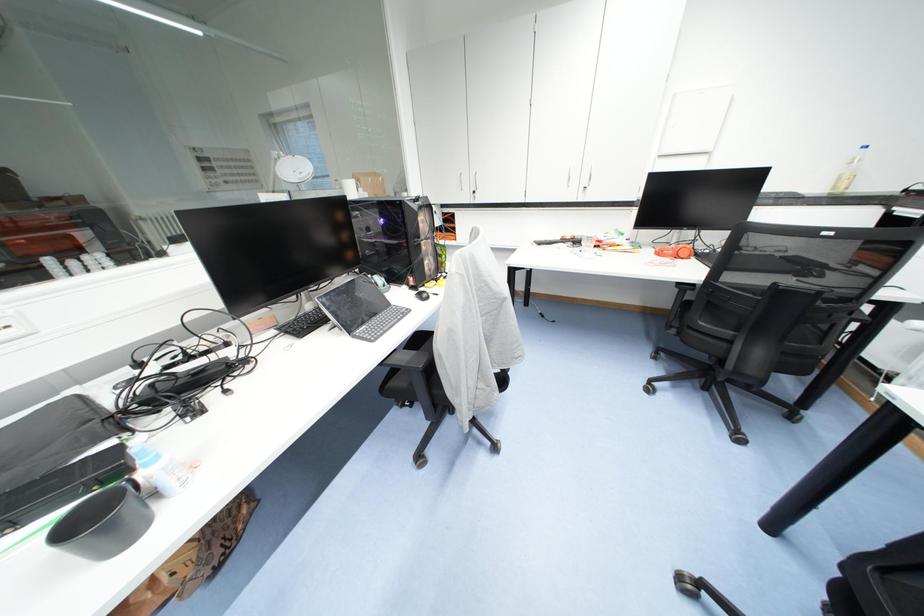
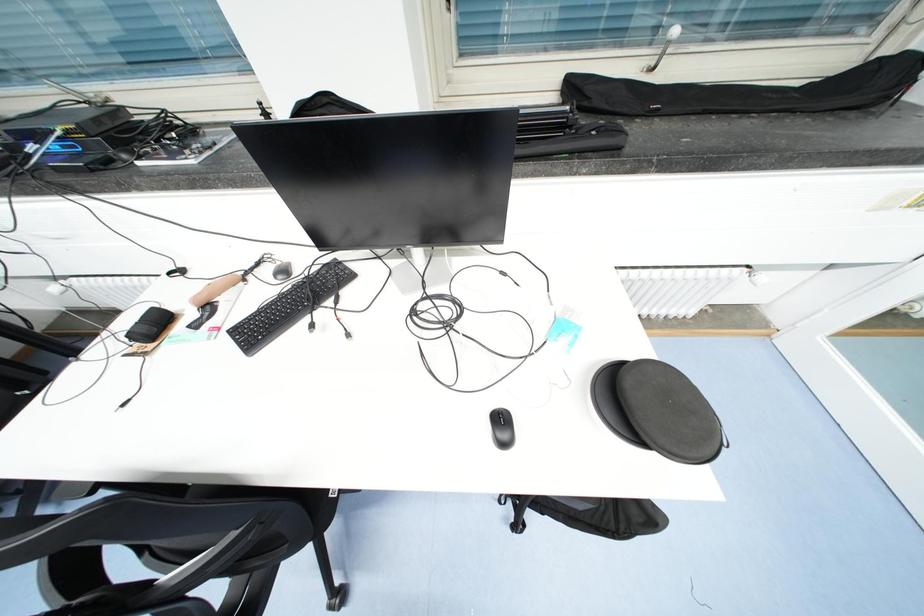
From the picture: How did the camera likely rotate?

The rotation direction of the camera is right-down.